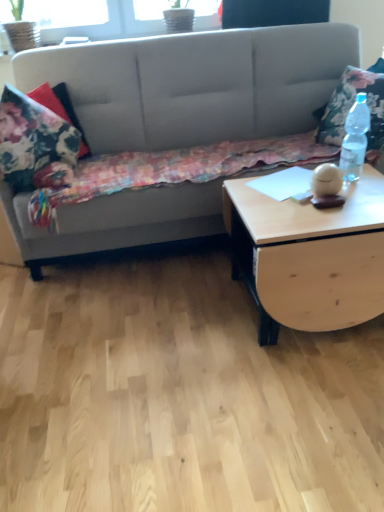
You are a GUI agent. You are given a task and a screenshot of the screen. Output one action in this format:
    pyautogui.click(x=<x>, y=<y>)
    Task: Click on the free region on the left part of light wood/texture coffee table at right
    
    Given the screenshot: What is the action you would take?
    pyautogui.click(x=183, y=316)